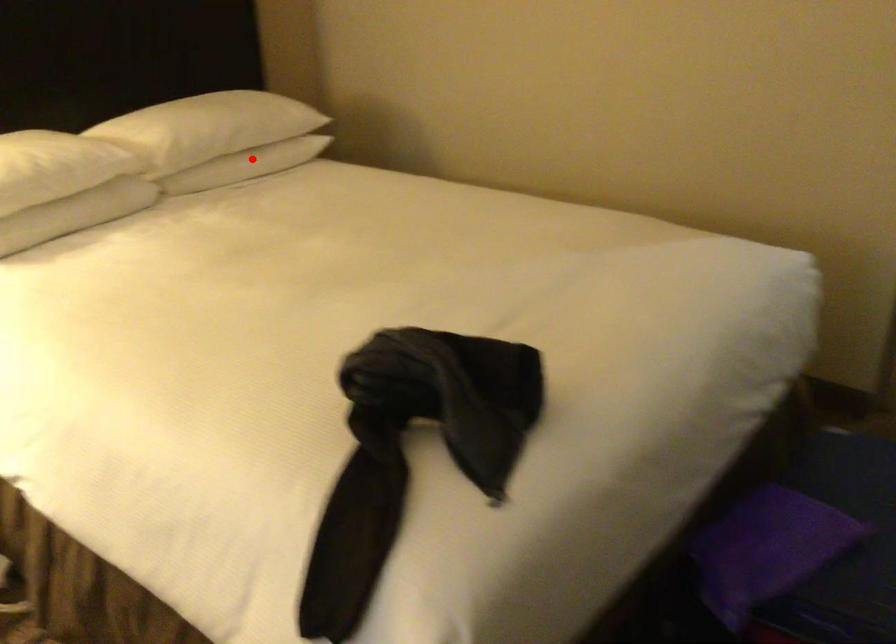
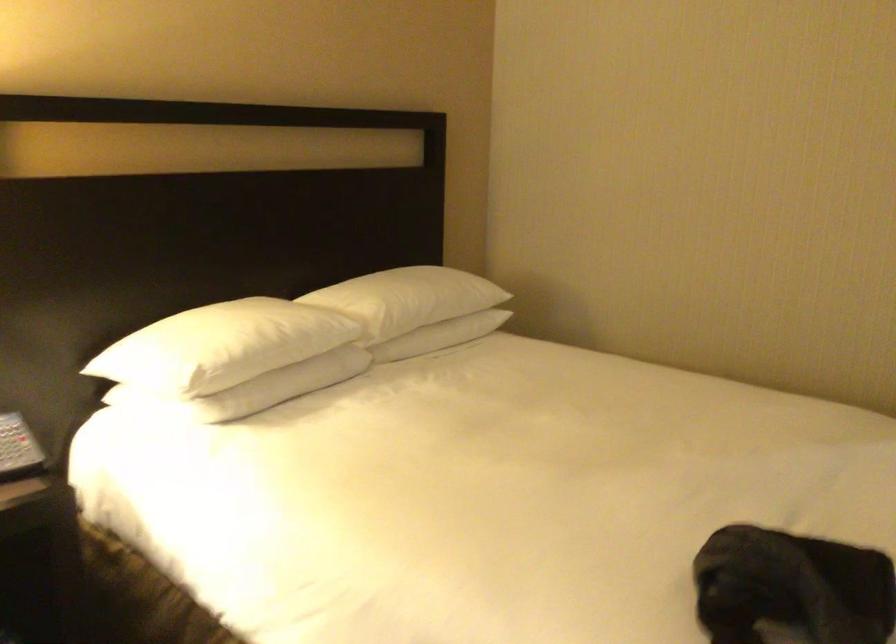
In the second image, find the point that corresponds to the highlighted location in the first image.

(443, 330)